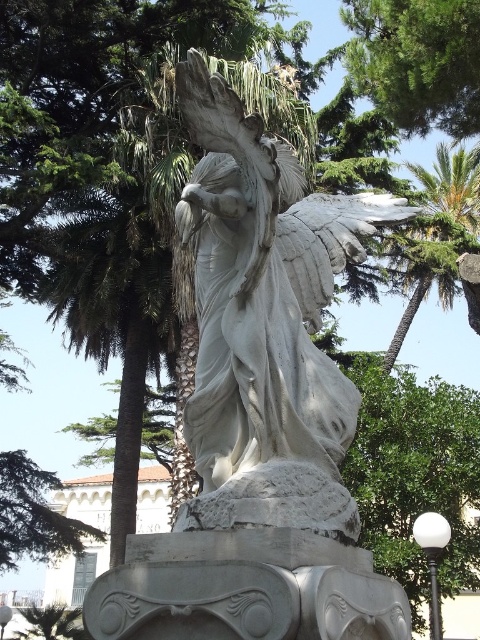
Question: Does white marble statue at center appear on the left side of green leafy palm tree at upper right?

Choices:
 (A) no
 (B) yes

Answer: (B)

Question: In this image, where is white marble statue at center located relative to green leafy palm tree at upper right?

Choices:
 (A) below
 (B) above

Answer: (A)

Question: Does white marble statue at center appear on the right side of green leafy palm tree at upper right?

Choices:
 (A) no
 (B) yes

Answer: (A)

Question: Which point is farther to the camera?

Choices:
 (A) white marble statue at center
 (B) green leafy palm tree at upper right

Answer: (B)

Question: Which of the following is the closest to the observer?

Choices:
 (A) (250, 404)
 (B) (415, 282)

Answer: (A)